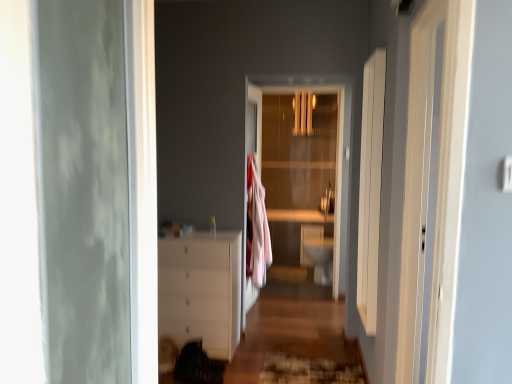
Find the location of a particular element. The image size is (512, 384). empty space that is ontop of textured brown rug at lower center (from a real-world perspective) is located at coordinates (310, 363).